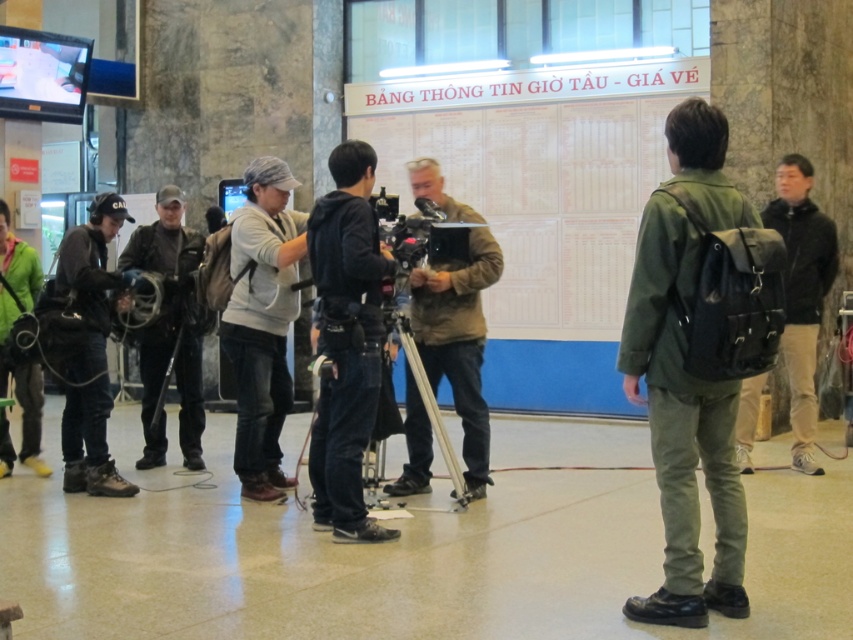
From the picture: Between white paperboard at center and green canvas backpack at center, which one has less height?

Standing shorter between the two is green canvas backpack at center.

Who is more distant from viewer, (438, 129) or (654, 456)?

Point (438, 129)

Find the location of `white paperboard at center`. white paperboard at center is located at coordinates coord(538,173).

Is matte black jacket at left positioned before black leather jacket at center?

Yes, it is in front of black leather jacket at center.

Does point (56, 289) come farther from viewer compared to point (201, 340)?

No.

Who is more forward, [102,417] or [161,353]?

Point [102,417] is more forward.

You are a GUI agent. You are given a task and a screenshot of the screen. Output one action in this format:
    pyautogui.click(x=<x>, y=<y>)
    Task: Click on the matte black jacket at left
    
    Given the screenshot: What is the action you would take?
    pyautogui.click(x=90, y=348)

Does brown leather jacket at center appear on the right side of black leather jacket at center?

Indeed, brown leather jacket at center is positioned on the right side of black leather jacket at center.

What do you see at coordinates (457, 340) in the screenshot?
I see `brown leather jacket at center` at bounding box center [457, 340].

Who is more forward, [415,433] or [190,368]?

Point [415,433] is in front.

You are a GUI agent. You are given a task and a screenshot of the screen. Output one action in this format:
    pyautogui.click(x=<x>, y=<y>)
    Task: Click on the brown leather jacket at center
    
    Given the screenshot: What is the action you would take?
    pyautogui.click(x=457, y=340)